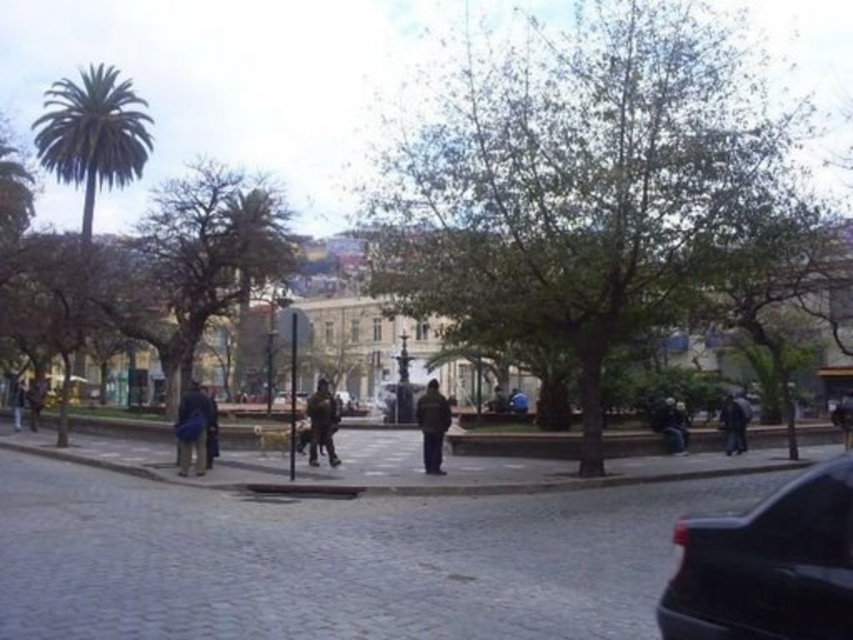
Does green leafy tree at left appear over dark brown leather jacket at center?

Correct, green leafy tree at left is located above dark brown leather jacket at center.

Measure the distance between green leafy tree at left and camera.

green leafy tree at left is 73.08 feet away from camera.

Where is `green leafy tree at left`? The height and width of the screenshot is (640, 853). green leafy tree at left is located at coordinates (207, 253).

This screenshot has height=640, width=853. Describe the element at coordinates (207, 253) in the screenshot. I see `green leafy tree at left` at that location.

Is green leafy tree at left to the left of green leafy palm tree at left from the viewer's perspective?

Incorrect, green leafy tree at left is not on the left side of green leafy palm tree at left.

Does point (192, 349) come closer to viewer compared to point (50, 156)?

Yes.

This screenshot has width=853, height=640. Find the location of `green leafy tree at left`. green leafy tree at left is located at coordinates (207, 253).

Does green leafy tree at center appear under brown leather jacket at lower left?

Actually, green leafy tree at center is above brown leather jacket at lower left.

From the picture: Who is more forward, (577,141) or (18,394)?

Point (577,141)

Between point (744, 212) and point (22, 392), which one is positioned behind?

The point (22, 392) is more distant.

I want to click on green leafy tree at center, so click(585, 184).